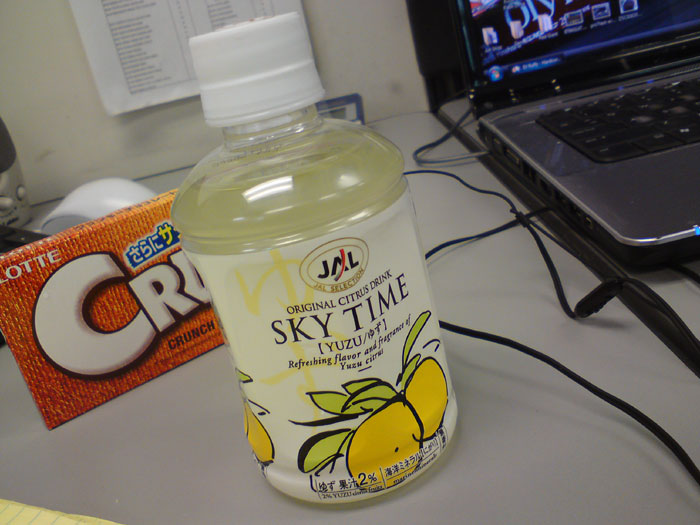
The height and width of the screenshot is (525, 700). Find the location of `mouse`. mouse is located at coordinates (101, 199).